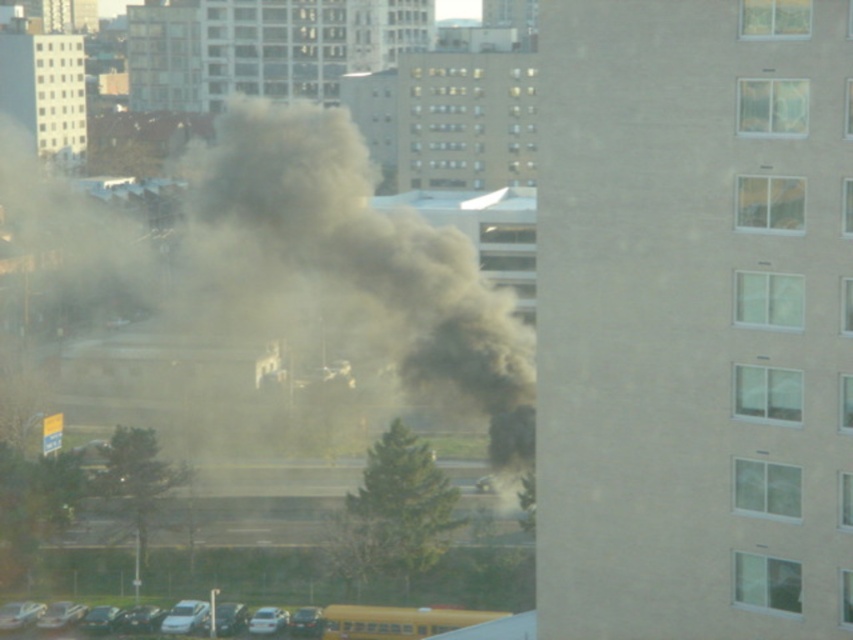
Question: Considering the relative positions of gray/dense smoke at center and yellow matte school bus at lower center in the image provided, where is gray/dense smoke at center located with respect to yellow matte school bus at lower center?

Choices:
 (A) left
 (B) right

Answer: (A)

Question: Does gray/dense smoke at center have a lesser width compared to yellow matte school bus at lower center?

Choices:
 (A) no
 (B) yes

Answer: (A)

Question: Does gray/dense smoke at center have a lesser width compared to yellow matte school bus at lower center?

Choices:
 (A) yes
 (B) no

Answer: (B)

Question: Which point is farther from the camera taking this photo?

Choices:
 (A) (341, 618)
 (B) (485, 316)

Answer: (B)